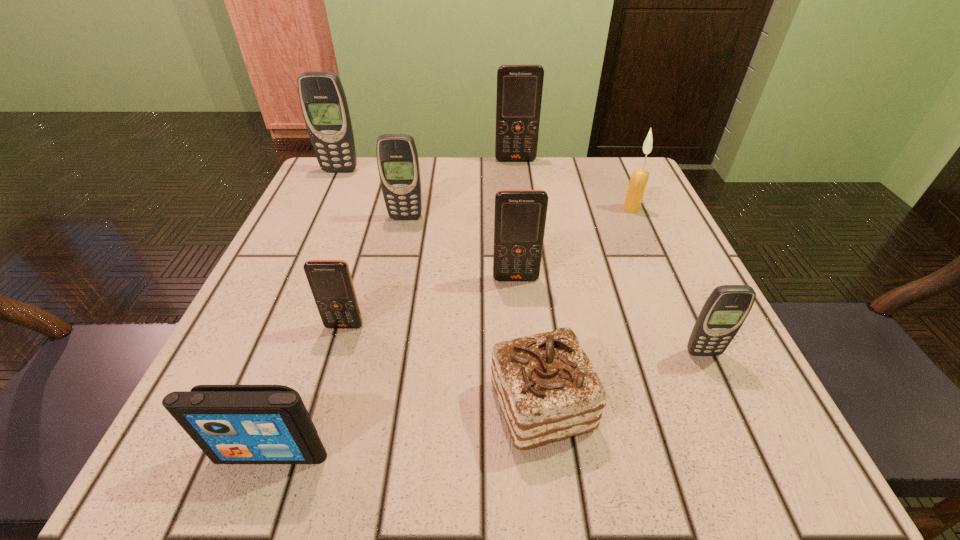
You are a GUI agent. You are given a task and a screenshot of the screen. Output one action in this format:
    pyautogui.click(x=<x>, y=<y>)
    Task: Click on the object present at the far left corner
    The image size is (960, 540).
    Given the screenshot: What is the action you would take?
    pyautogui.click(x=323, y=101)

What are the coordinates of `object present at the near left corner` in the screenshot? It's located at (232, 424).

Locate an element on the screen. object situated at the far right corner is located at coordinates (639, 177).

In the image, there is a desktop. Where is `free region at the far edge`? The height and width of the screenshot is (540, 960). free region at the far edge is located at coordinates (543, 182).

In the image, there is a desktop. Identify the location of vacant space at the near edge. The height and width of the screenshot is (540, 960). (499, 419).

Where is `vacant area at the left edge of the desktop`? This screenshot has width=960, height=540. vacant area at the left edge of the desktop is located at coordinates (261, 312).

Identify the location of free location at the right edge. This screenshot has width=960, height=540. (619, 302).

This screenshot has height=540, width=960. What are the coordinates of `free location at the far left corner of the desktop` in the screenshot? It's located at (326, 178).

Locate an element on the screen. vacant area between the cream candle and the fifth farthest cellular telephone is located at coordinates (488, 267).

Locate an element on the screen. vacant region between the second biggest orange cellular telephone and the iPod is located at coordinates (394, 366).